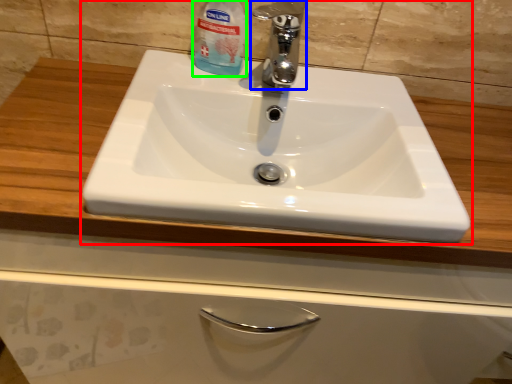
Question: Considering the real-world distances, which object is farthest from sink (highlighted by a red box)? tap (highlighted by a blue box) or cleaning product (highlighted by a green box)?

Choices:
 (A) tap
 (B) cleaning product

Answer: (B)